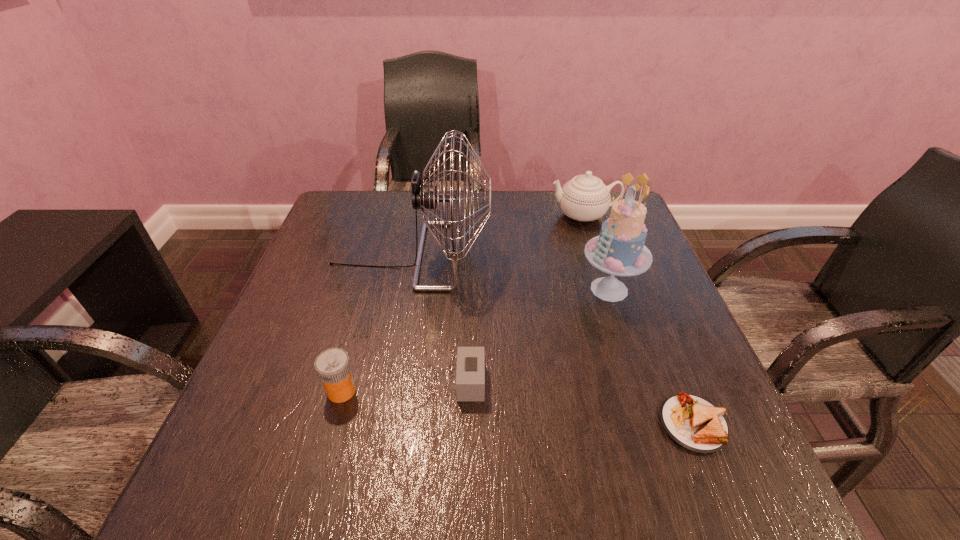
Identify the location of vacant space positioned on the spout of the chinaware. (460, 215).

You are a GUI agent. You are given a task and a screenshot of the screen. Output one action in this format:
    pyautogui.click(x=<x>, y=<y>)
    Task: Click on the free space located on the spout of the chinaware
    The height and width of the screenshot is (540, 960).
    Given the screenshot: What is the action you would take?
    pyautogui.click(x=456, y=215)

Locate an element on the screen. vacant area situated on the spout of the chinaware is located at coordinates (524, 215).

This screenshot has width=960, height=540. Identify the location of vacant space located on the label side of the medicine. tap(384, 391).

Locate an element on the screen. Image resolution: width=960 pixels, height=540 pixels. vacant region located 0.400m on the front-facing side of the second shortest object is located at coordinates (701, 382).

Where is `free region located on the back of the sandwich`? This screenshot has height=540, width=960. free region located on the back of the sandwich is located at coordinates (646, 306).

Identify the location of fan present at the far edge. The width and height of the screenshot is (960, 540). (425, 196).

You are a GUI agent. You are given a task and a screenshot of the screen. Output one action in this format:
    pyautogui.click(x=<x>, y=<y>)
    Task: Click on the chinaware that is at the far edge
    This screenshot has height=540, width=960.
    Given the screenshot: What is the action you would take?
    pyautogui.click(x=585, y=197)

At what (x,y) coordinates should I click in order to perform the action: click on fan that is positioned at the left edge. Please return your answer as a coordinate pair (x, y). This screenshot has width=960, height=540. Looking at the image, I should click on (425, 196).

Locate an element on the screen. medicine located in the left edge section of the desktop is located at coordinates (333, 367).